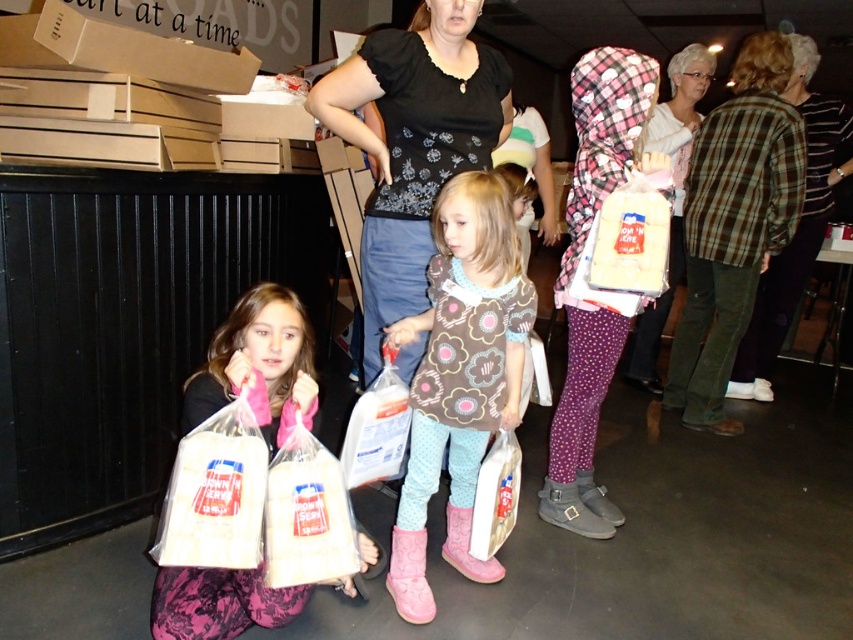
Question: Does black printed blouse at center come behind plaid fabric bag at upper right?

Choices:
 (A) no
 (B) yes

Answer: (A)

Question: Estimate the real-world distances between objects in this image. Which object is farther from the translucent plastic bag at lower center?

Choices:
 (A) white plastic bag at center
 (B) plaid fabric bag at upper right

Answer: (B)

Question: Which of the following is the farthest from the observer?

Choices:
 (A) (190, 528)
 (B) (500, 468)

Answer: (B)

Question: Is pink fabric dress at lower left positioned in front of white plastic bag of popcorn at lower left?

Choices:
 (A) yes
 (B) no

Answer: (B)

Question: Which is nearer to the pink fabric dress at lower left?

Choices:
 (A) plaid fabric bag at upper right
 (B) green plaid shirt at upper right
 (C) white paper bag at lower center

Answer: (C)

Question: Is white plastic bag at center positioned in front of white paper bag at lower center?

Choices:
 (A) yes
 (B) no

Answer: (A)